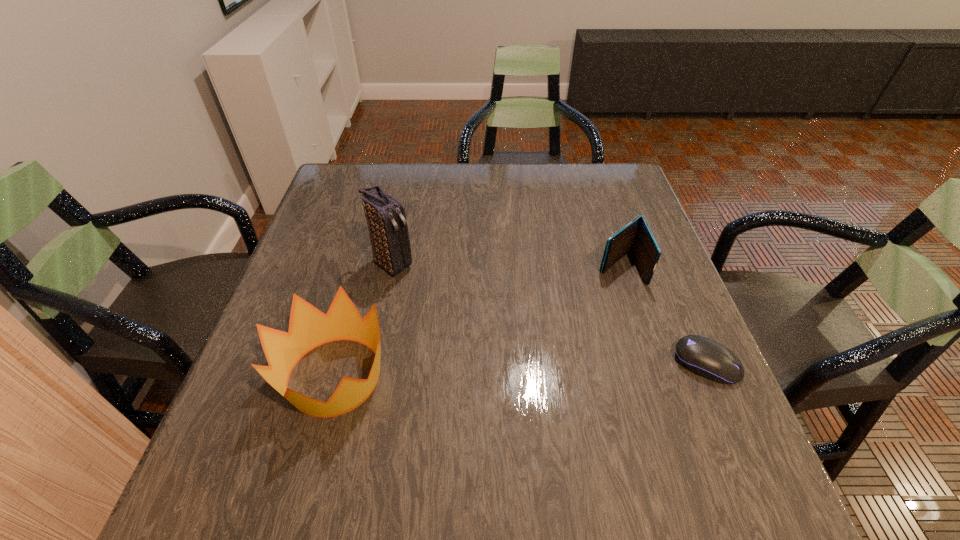
Locate an element on the screen. The image size is (960, 540). the third shortest object is located at coordinates (309, 328).

Locate an element on the screen. computer mouse is located at coordinates (705, 357).

Where is `clutch bag`? clutch bag is located at coordinates (385, 215).

This screenshot has width=960, height=540. In order to click on the third tallest object in this screenshot , I will do `click(637, 237)`.

This screenshot has height=540, width=960. What are the coordinates of `free space located on the right of the second tallest object` in the screenshot? It's located at (484, 376).

Locate an element on the screen. The height and width of the screenshot is (540, 960). blank space located on the front of the shortest object is located at coordinates point(728,410).

I want to click on vacant area situated with the zip open on the tallest object, so click(537, 375).

Find the location of a particular element. free region located 0.180m with the zip open on the tallest object is located at coordinates (459, 315).

This screenshot has height=540, width=960. I want to click on vacant space situated 0.210m with the zip open on the tallest object, so click(x=468, y=322).

Identify the location of free location located on the exterior surface of the wallet. coord(520,346).